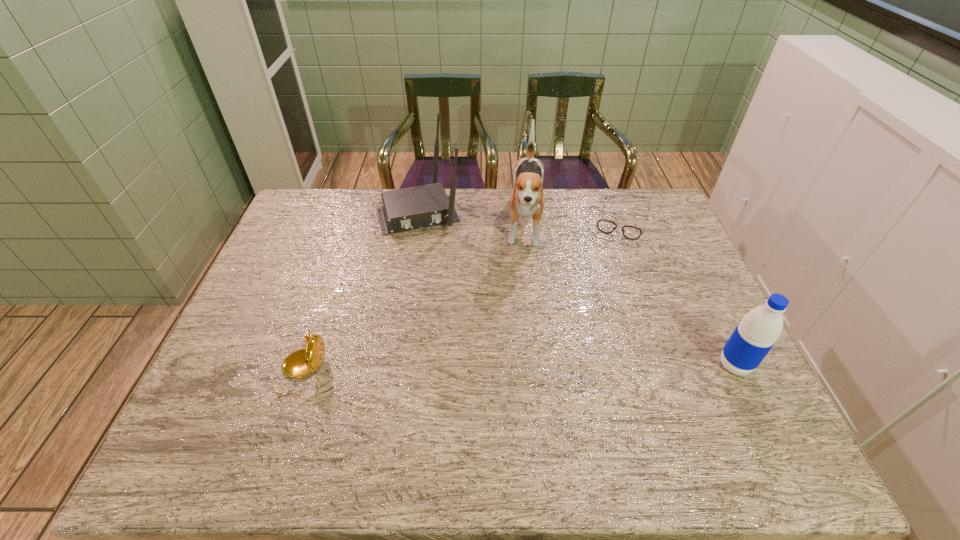
At what (x,y) coordinates should I click in order to perform the action: click on vacant spot on the desktop that is between the fourth tallest object and the water bottle and is positioned on the front-facing side of the shortest object. Please return your answer as a coordinate pair (x, y). Looking at the image, I should click on (574, 368).

Where is `free space on the desktop that is between the fourth tallest object and the third tallest object and is positioned at the face of the third object from right to left`? Image resolution: width=960 pixels, height=540 pixels. free space on the desktop that is between the fourth tallest object and the third tallest object and is positioned at the face of the third object from right to left is located at coordinates (517, 370).

Identify the location of free spot on the desktop that is between the pocket watch and the rightmost object and is positioned on the back of the fourth object from right to left to connect cables. (471, 371).